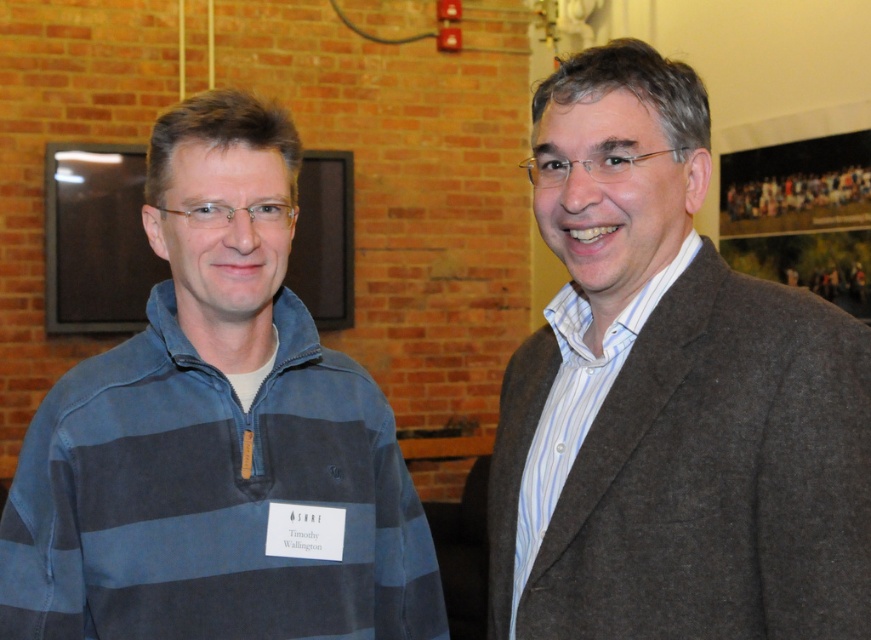
Is gray woolen blazer at right bigger than blue striped sweater at left?

Correct, gray woolen blazer at right is larger in size than blue striped sweater at left.

Measure the distance from gray woolen blazer at right to blue striped sweater at left.

gray woolen blazer at right is 15.34 inches away from blue striped sweater at left.

Is point (694, 156) positioned after point (159, 483)?

No, it is in front of (159, 483).

Locate an element on the screen. The width and height of the screenshot is (871, 640). gray woolen blazer at right is located at coordinates (669, 397).

Does point (201, 246) lie behind point (139, 218)?

No, (201, 246) is closer to viewer.

Which is more to the right, blue striped sweater at left or matte black monitor at upper left?

From the viewer's perspective, blue striped sweater at left appears more on the right side.

The width and height of the screenshot is (871, 640). What are the coordinates of `blue striped sweater at left` in the screenshot? It's located at (217, 436).

Locate an element on the screen. Image resolution: width=871 pixels, height=640 pixels. blue striped sweater at left is located at coordinates (217, 436).

Who is positioned more to the left, gray woolen blazer at right or matte black monitor at upper left?

matte black monitor at upper left is more to the left.

Who is shorter, gray woolen blazer at right or matte black monitor at upper left?

Standing shorter between the two is matte black monitor at upper left.

Locate an element on the screen. gray woolen blazer at right is located at coordinates (669, 397).